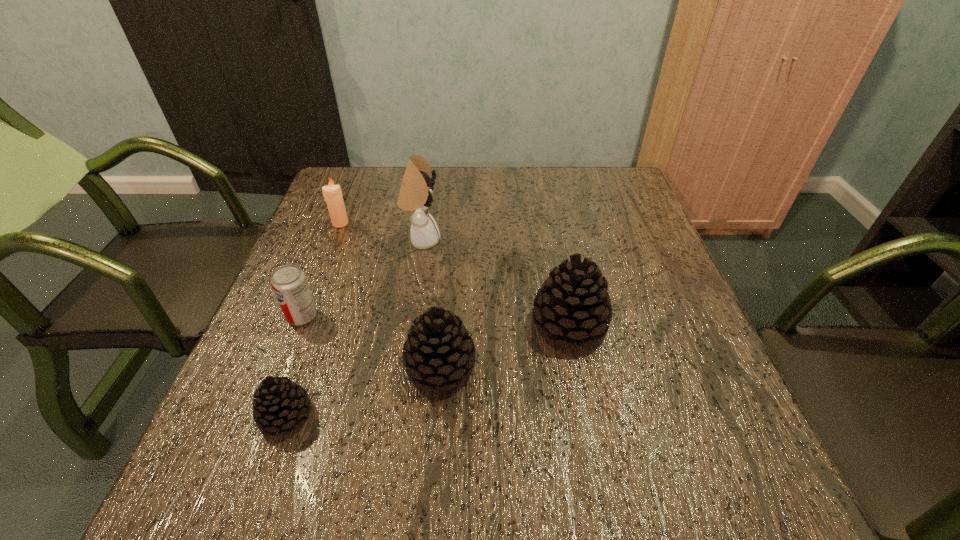
Find the location of a particular element. The image size is (960, 540). free spot at the left edge of the desktop is located at coordinates (329, 294).

This screenshot has width=960, height=540. In the image, there is a desktop. Find the location of `vacant space at the far left corner`. vacant space at the far left corner is located at coordinates (374, 174).

At what (x,y) coordinates should I click in order to perform the action: click on vacant space at the far right corner of the desktop. Please return your answer as a coordinate pair (x, y). Image resolution: width=960 pixels, height=540 pixels. Looking at the image, I should click on (619, 168).

At what (x,y) coordinates should I click in order to perform the action: click on unoccupied position between the shortest pinecone and the soda. Please return your answer as a coordinate pair (x, y). This screenshot has height=540, width=960. Looking at the image, I should click on (294, 366).

Locate an element on the screen. This screenshot has width=960, height=540. vacant space in between the second shortest pinecone and the rightmost pinecone is located at coordinates (505, 345).

You are a GUI agent. You are given a task and a screenshot of the screen. Output one action in this format:
    pyautogui.click(x=<x>, y=<y>)
    Task: Click on the free space between the second tallest pinecone and the doll
    The height and width of the screenshot is (540, 960).
    Given the screenshot: What is the action you would take?
    pyautogui.click(x=431, y=303)

In order to click on empty location between the candle and the fifth tallest object in this screenshot , I will do `click(322, 269)`.

Image resolution: width=960 pixels, height=540 pixels. In order to click on free point between the rightmost object and the candle in this screenshot , I will do `click(455, 274)`.

Where is `vacant space in between the rightmost pinecone and the doll`? vacant space in between the rightmost pinecone and the doll is located at coordinates (495, 282).

Where is `free point between the second shortest object and the tallest object`? This screenshot has height=540, width=960. free point between the second shortest object and the tallest object is located at coordinates (362, 278).